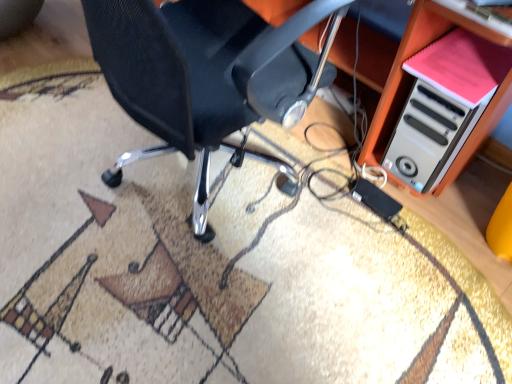
Question: Is white plastic computer case at lower right oriented towards pink matte book at upper right?

Choices:
 (A) yes
 (B) no

Answer: (A)

Question: Is white plastic computer case at lower right positioned far away from pink matte book at upper right?

Choices:
 (A) yes
 (B) no

Answer: (B)

Question: From the image's perspective, is white plastic computer case at lower right located beneath pink matte book at upper right?

Choices:
 (A) yes
 (B) no

Answer: (B)

Question: Considering the relative sizes of white plastic computer case at lower right and pink matte book at upper right in the image provided, is white plastic computer case at lower right shorter than pink matte book at upper right?

Choices:
 (A) no
 (B) yes

Answer: (A)

Question: Is white plastic computer case at lower right positioned with its back to pink matte book at upper right?

Choices:
 (A) yes
 (B) no

Answer: (A)

Question: Considering the relative positions of white plastic computer case at lower right and pink matte book at upper right in the image provided, is white plastic computer case at lower right to the left of pink matte book at upper right from the viewer's perspective?

Choices:
 (A) yes
 (B) no

Answer: (A)

Question: Is pink matte book at upper right bigger than white plastic computer case at lower right?

Choices:
 (A) yes
 (B) no

Answer: (B)

Question: From the image's perspective, is pink matte book at upper right located above white plastic computer case at lower right?

Choices:
 (A) no
 (B) yes

Answer: (A)

Question: Is white plastic computer case at lower right completely or partially inside pink matte book at upper right?

Choices:
 (A) no
 (B) yes

Answer: (A)

Question: From a real-world perspective, is pink matte book at upper right below white plastic computer case at lower right?

Choices:
 (A) yes
 (B) no

Answer: (B)

Question: Considering the relative sizes of pink matte book at upper right and white plastic computer case at lower right in the image provided, is pink matte book at upper right smaller than white plastic computer case at lower right?

Choices:
 (A) yes
 (B) no

Answer: (A)

Question: Considering the relative positions of pink matte book at upper right and white plastic computer case at lower right in the image provided, is pink matte book at upper right to the right of white plastic computer case at lower right from the viewer's perspective?

Choices:
 (A) yes
 (B) no

Answer: (A)

Question: Is black mesh chair at center turned away from white plastic computer case at lower right?

Choices:
 (A) no
 (B) yes

Answer: (A)